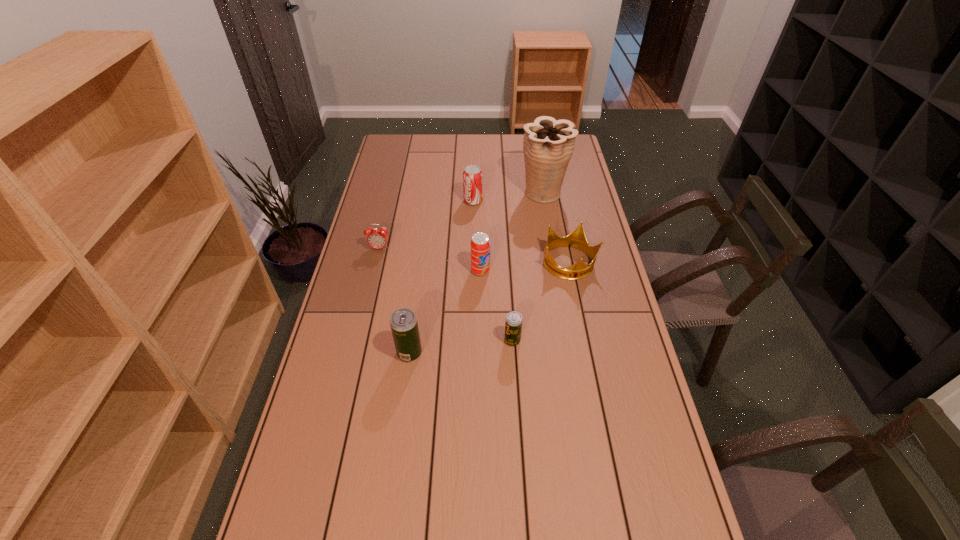
With all beer cans evenly spaced, where should an extra beer can be placed on the right to continue the pattern? Please point out a vacant space. Please provide its 2D coordinates. Your answer should be formatted as a tuple, i.e. [(x, y)], where the tuple contains the x and y coordinates of a point satisfying the conditions above.

[(611, 329)]